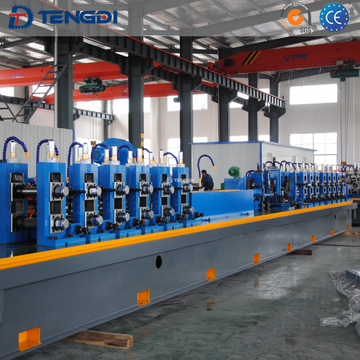
Find the location of a particular element. This screenshot has height=360, width=360. support beam is located at coordinates (65, 117), (135, 120), (183, 125), (221, 125), (256, 129), (276, 129).